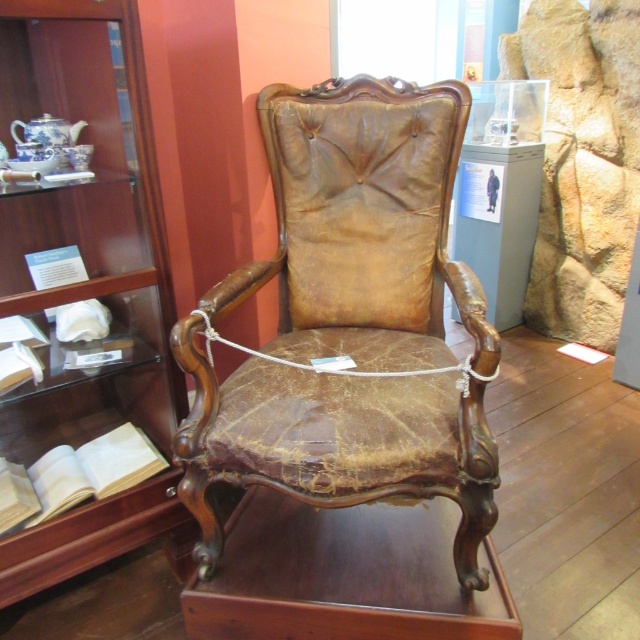
You are a museum security guard who needs to place a 25 cm wide barrier between the wooden bookshelf at center and the light brown paper book at lower left. Is there enough space to place the barrier between them?

The distance between the wooden bookshelf at center and the light brown paper book at lower left is 23.58 centimeters, so the barrier cannot be placed between them since it is wider than the available space.

Based on the photo, you are a visitor at the museum and want to read the book titled on the light brown paper book at lower left. However, the book is placed on the wooden bookshelf at center. Can you reach it without climbing?

The wooden bookshelf at center has a larger size compared to light brown paper book at lower left, so the book may be placed on a higher shelf. You might need to use a stool or ask for assistance to reach it.